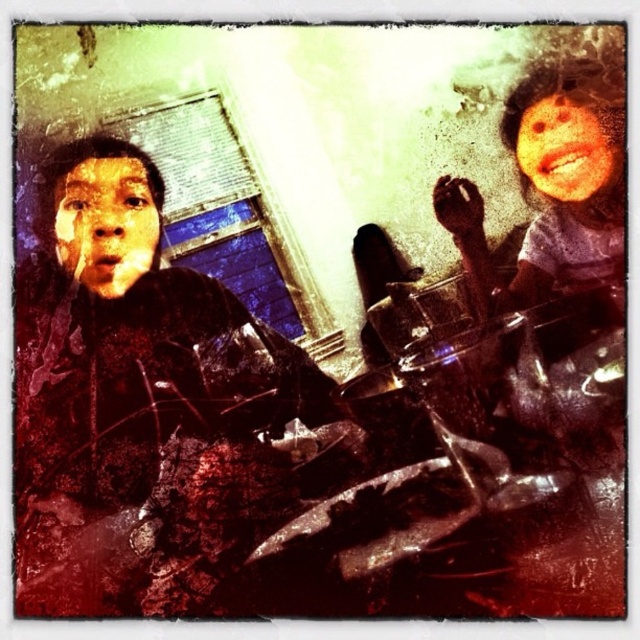
Question: Which of these objects is positioned farthest from the matte plastic girl at upper right?

Choices:
 (A) matte black face at left
 (B) matte black jacket at left

Answer: (A)

Question: Does matte plastic girl at upper right appear on the right side of smooth skin face at upper right?

Choices:
 (A) no
 (B) yes

Answer: (A)

Question: Which of the following is the farthest from the observer?

Choices:
 (A) matte black face at left
 (B) smooth skin face at upper right

Answer: (B)

Question: Which is nearer to the matte plastic girl at upper right?

Choices:
 (A) matte black jacket at left
 (B) matte black face at left

Answer: (A)

Question: Where is matte black jacket at left located in relation to matte plastic girl at upper right in the image?

Choices:
 (A) right
 (B) left

Answer: (B)

Question: Can you confirm if matte black face at left is bigger than smooth skin face at upper right?

Choices:
 (A) yes
 (B) no

Answer: (A)